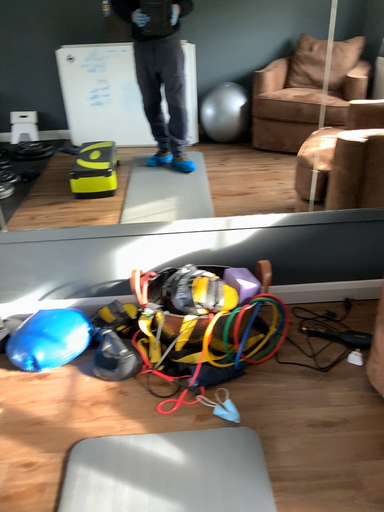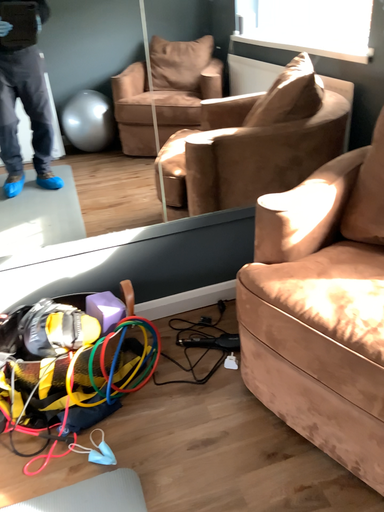
Question: How did the camera likely rotate when shooting the video?

Choices:
 (A) rotated left
 (B) rotated right

Answer: (B)